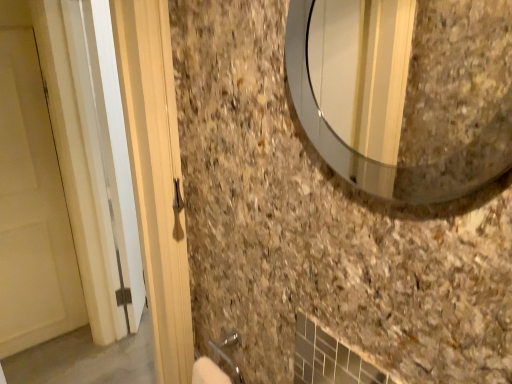
At what (x,y) coordinates should I click in order to perform the action: click on clear glass mirror at upper right. Please return your answer as a coordinate pair (x, y). This screenshot has height=384, width=512. Looking at the image, I should click on (358, 153).

The width and height of the screenshot is (512, 384). What do you see at coordinates (358, 153) in the screenshot?
I see `clear glass mirror at upper right` at bounding box center [358, 153].

Describe the element at coordinates (32, 209) in the screenshot. This screenshot has height=384, width=512. I see `white matte door at left` at that location.

Where is `white matte door at left`? Image resolution: width=512 pixels, height=384 pixels. white matte door at left is located at coordinates (32, 209).

Where is `clear glass mirror at upper right`? The height and width of the screenshot is (384, 512). clear glass mirror at upper right is located at coordinates click(x=358, y=153).

Does white matte door at left appear on the left side of clear glass mirror at upper right?

Indeed, white matte door at left is positioned on the left side of clear glass mirror at upper right.

Based on the photo, relative to clear glass mirror at upper right, is white matte door at left in front or behind?

Clearly, white matte door at left is behind clear glass mirror at upper right.

Considering the positions of points (30, 44) and (291, 80), is point (30, 44) closer to camera compared to point (291, 80)?

That is False.

From the image's perspective, which one is positioned lower, white matte door at left or clear glass mirror at upper right?

white matte door at left, from the image's perspective.

From a real-world perspective, is white matte door at left below clear glass mirror at upper right?

Correct, in the physical world, white matte door at left is lower than clear glass mirror at upper right.

Looking at their sizes, would you say white matte door at left is wider or thinner than clear glass mirror at upper right?

In the image, white matte door at left appears to be more narrow than clear glass mirror at upper right.

Considering the sizes of white matte door at left and clear glass mirror at upper right in the image, is white matte door at left taller or shorter than clear glass mirror at upper right?

In the image, white matte door at left appears to be taller than clear glass mirror at upper right.

Which of these two, white matte door at left or clear glass mirror at upper right, is smaller?

Smaller between the two is clear glass mirror at upper right.

Is white matte door at left completely or partially outside of clear glass mirror at upper right?

Yes, white matte door at left is not within clear glass mirror at upper right.

Is there a large distance between white matte door at left and clear glass mirror at upper right?

Yes, white matte door at left and clear glass mirror at upper right are located far from each other.

Is white matte door at left turned away from clear glass mirror at upper right?

No, white matte door at left is not facing away from clear glass mirror at upper right.

The height and width of the screenshot is (384, 512). I want to click on mirror in front of the white matte door at left, so click(x=358, y=153).

Visually, is clear glass mirror at upper right positioned to the left or to the right of white matte door at left?

Clearly, clear glass mirror at upper right is on the right of white matte door at left in the image.

Is clear glass mirror at upper right closer to the viewer compared to white matte door at left?

Yes, it is in front of white matte door at left.

Which point is more distant from viewer, [390,181] or [25,289]?

Positioned behind is point [25,289].

From the image's perspective, which object appears higher, clear glass mirror at upper right or white matte door at left?

clear glass mirror at upper right appears higher in the image.

From a real-world perspective, between clear glass mirror at upper right and white matte door at left, who is vertically lower?

In real-world perspective, white matte door at left is lower.

Considering the relative sizes of clear glass mirror at upper right and white matte door at left in the image provided, is clear glass mirror at upper right wider than white matte door at left?

Indeed, clear glass mirror at upper right has a greater width compared to white matte door at left.

Between clear glass mirror at upper right and white matte door at left, which one has more height?

white matte door at left.

Considering the sizes of objects clear glass mirror at upper right and white matte door at left in the image provided, who is smaller, clear glass mirror at upper right or white matte door at left?

Smaller between the two is clear glass mirror at upper right.

Would you say clear glass mirror at upper right is inside or outside white matte door at left?

clear glass mirror at upper right is not inside white matte door at left, it's outside.

Is clear glass mirror at upper right next to white matte door at left?

clear glass mirror at upper right and white matte door at left are not in contact.

Is clear glass mirror at upper right oriented towards white matte door at left?

No, clear glass mirror at upper right is not aimed at white matte door at left.

Can you tell me how much clear glass mirror at upper right and white matte door at left differ in facing direction?

They differ by 89.5 degrees in their facing directions.

Find the location of a particular element. This screenshot has width=512, height=384. door below the clear glass mirror at upper right (from the image's perspective) is located at coordinates (32, 209).

You are a GUI agent. You are given a task and a screenshot of the screen. Output one action in this format:
    pyautogui.click(x=<x>, y=<y>)
    Task: Click on the mirror in front of the white matte door at left
    The height and width of the screenshot is (384, 512).
    Given the screenshot: What is the action you would take?
    pyautogui.click(x=358, y=153)

Locate an element on the screen. This screenshot has height=384, width=512. door to the left of clear glass mirror at upper right is located at coordinates point(32,209).